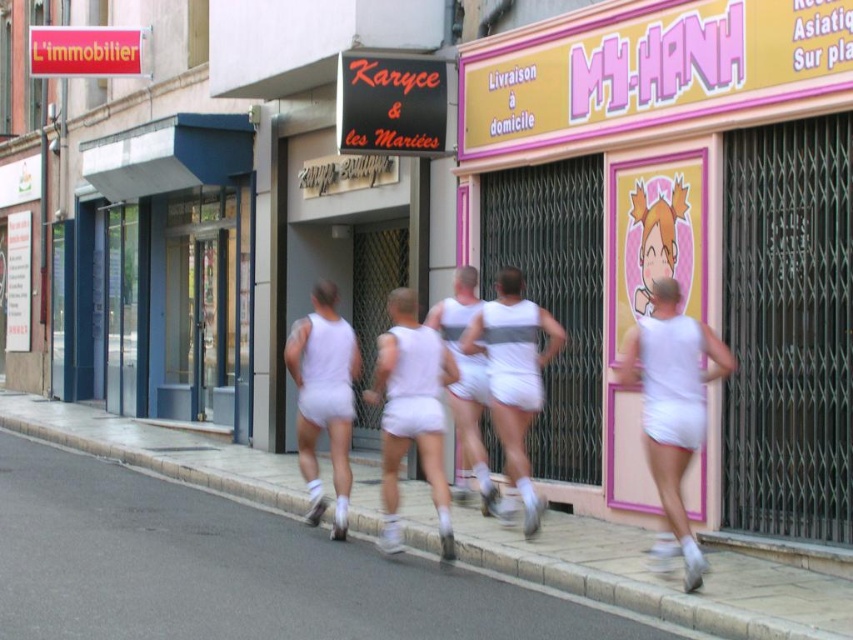
Question: Is pink matte sign at center above white concrete curb at lower center?

Choices:
 (A) no
 (B) yes

Answer: (B)

Question: Which of these objects is positioned closest to the white fabric shorts at center?

Choices:
 (A) pink matte sign at center
 (B) white concrete curb at lower center

Answer: (A)

Question: Which point is closer to the camera taking this photo?

Choices:
 (A) (670, 164)
 (B) (641, 378)
 (C) (564, 524)

Answer: (B)

Question: Which of the following is the farthest from the observer?

Choices:
 (A) white concrete curb at lower center
 (B) white matte shorts at right

Answer: (B)

Question: Does pink matte sign at center appear over white cotton shorts at center?

Choices:
 (A) yes
 (B) no

Answer: (A)

Question: Can you confirm if pink matte sign at center is smaller than white cotton shorts at center?

Choices:
 (A) no
 (B) yes

Answer: (A)